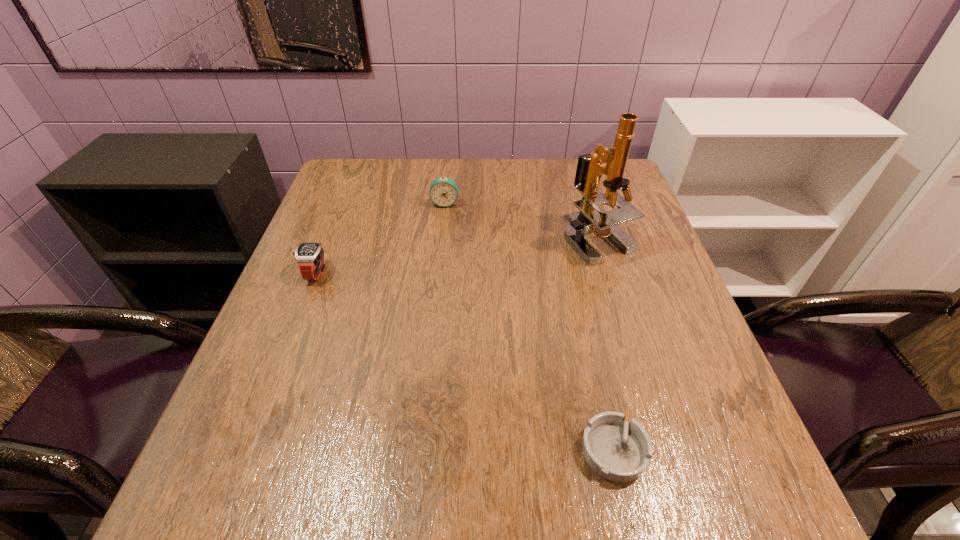
Image resolution: width=960 pixels, height=540 pixels. I want to click on free point located on the back of the ashtray, so click(590, 347).

The height and width of the screenshot is (540, 960). I want to click on object located in the far edge section of the desktop, so click(x=443, y=192).

Locate an element on the screen. This screenshot has width=960, height=540. object that is positioned at the near edge is located at coordinates (617, 449).

Locate an element on the screen. object at the left edge is located at coordinates (309, 256).

The height and width of the screenshot is (540, 960). In order to click on object situated at the right edge in this screenshot , I will do `click(590, 218)`.

This screenshot has width=960, height=540. In the image, there is a desktop. What are the coordinates of `free space at the far edge` in the screenshot? It's located at (504, 197).

Where is `vacant space at the near edge of the desktop`? vacant space at the near edge of the desktop is located at coordinates (580, 481).

Find the location of a particular element. Image resolution: width=960 pixels, height=540 pixels. blank space at the left edge is located at coordinates (355, 273).

In the image, there is a desktop. At what (x,y) coordinates should I click in order to perform the action: click on free space at the right edge. Please return your answer as a coordinate pair (x, y). The image size is (960, 540). Looking at the image, I should click on (607, 259).

The width and height of the screenshot is (960, 540). In the image, there is a desktop. In order to click on free region at the near right corner in this screenshot , I will do `click(680, 510)`.